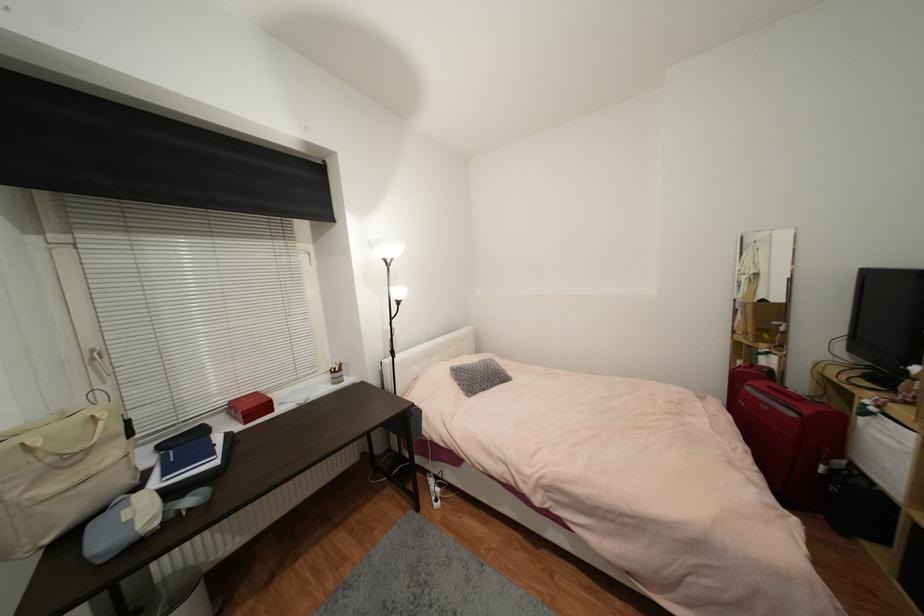
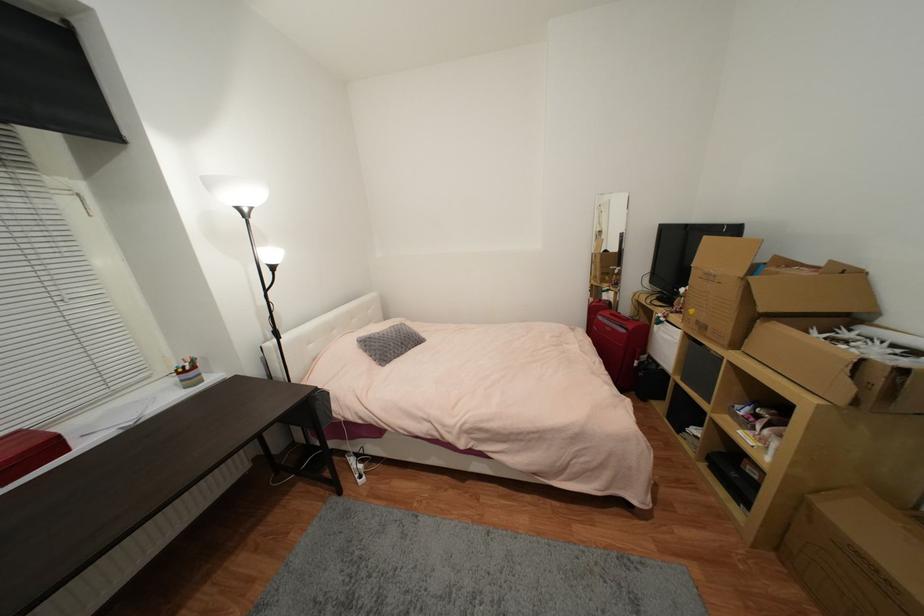
The point at (752, 390) is marked in the first image. Where is the corresponding point in the second image?

(603, 318)